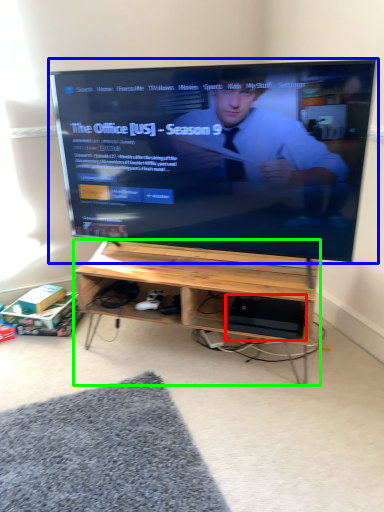
Question: Based on their relative distances, which object is farther from computer (highlighted by a red box)? Choose from television (highlighted by a blue box) and desk (highlighted by a green box).

Choices:
 (A) television
 (B) desk

Answer: (A)